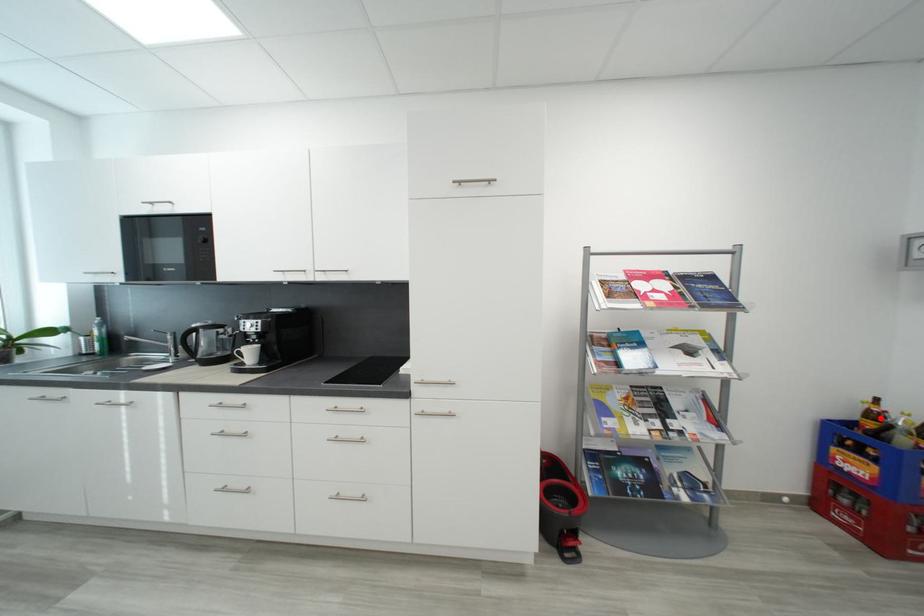
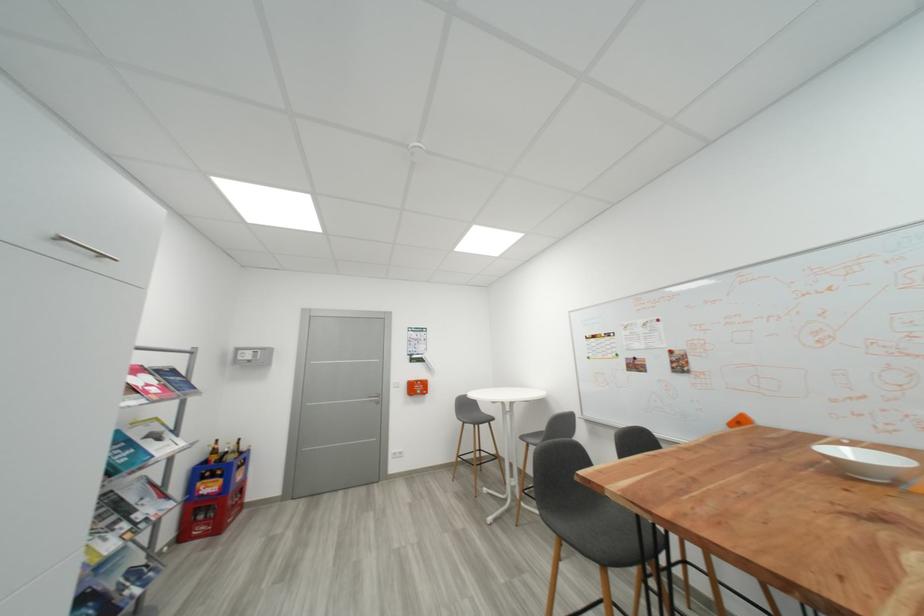
In the second image, find the point that corresponds to the highlighted location in the first image.

(223, 454)